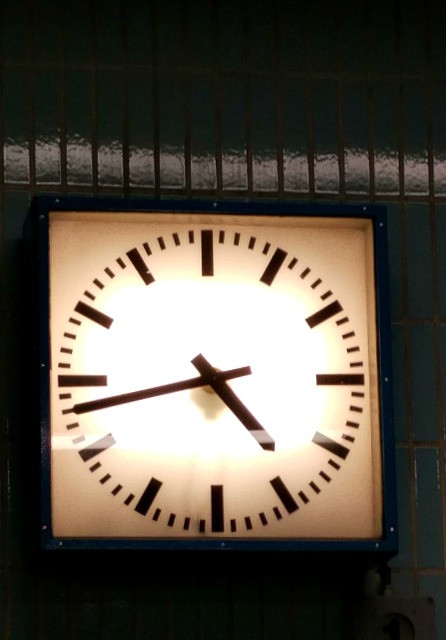
Locate an element on the screen. Image resolution: width=446 pixels, height=640 pixels. clock is located at coordinates (249, 370).